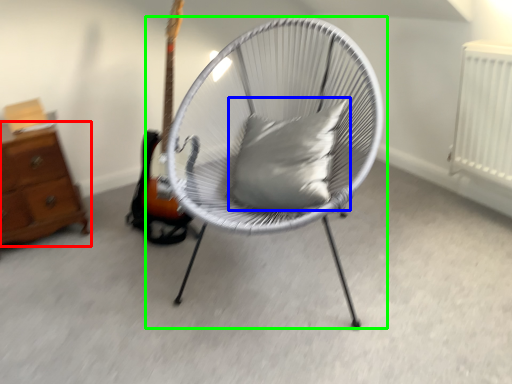
Question: Based on their relative distances, which object is nearer to chest of drawers (highlighted by a red box)? Choose from pillow (highlighted by a blue box) and chair (highlighted by a green box).

Choices:
 (A) pillow
 (B) chair

Answer: (B)